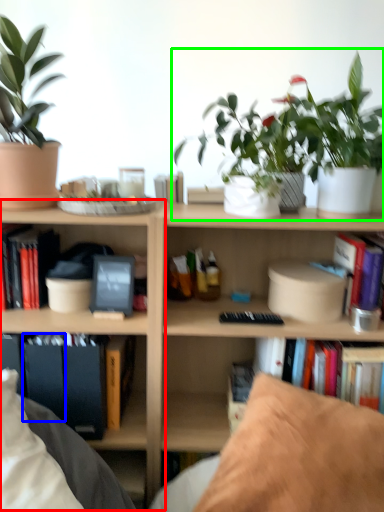
Question: Estimate the real-world distances between objects in this image. Which object is farther from shelf (highlighted by a red box), paperback book (highlighted by a blue box) or houseplant (highlighted by a green box)?

Choices:
 (A) paperback book
 (B) houseplant

Answer: (B)